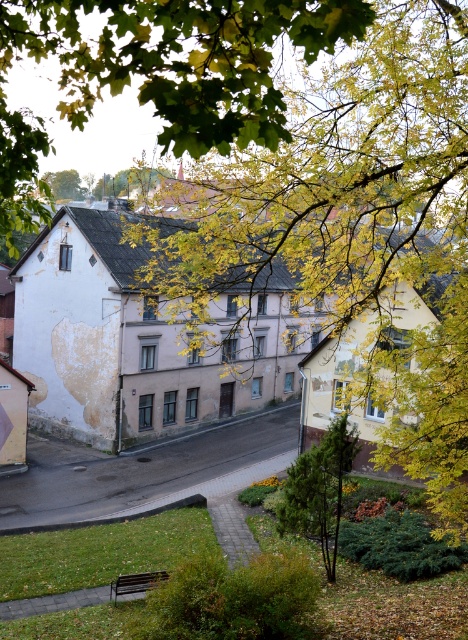
You are an architect designing a new garden layout and want to incorporate both the yellow leafy branches at upper center and the green leafy tree at upper center. Based on their heights, which one should be placed in a position where height is a critical factor?

The yellow leafy branches at upper center should be placed in the position where height is a critical factor since they are taller than the green leafy tree at upper center according to the description.

You are a painter who needs to decide which object to paint first. The white painted wall at left and the wooden park bench at lower center are both in need of painting. Considering their sizes, which one would you prioritize?

The white painted wall at left is larger in size than the wooden park bench at lower center, so you should prioritize painting the white painted wall at left first.